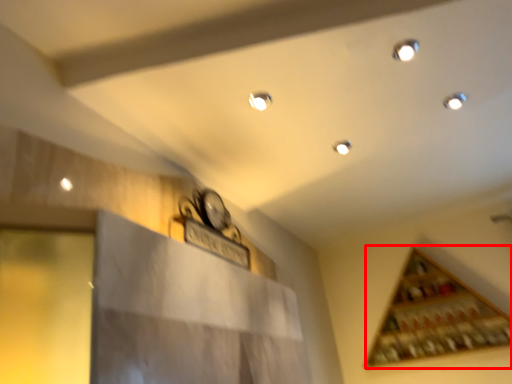
Question: From the image's perspective, considering the relative positions of wine rack (annotated by the red box) and light in the image provided, where is wine rack (annotated by the red box) located with respect to the staircase?

Choices:
 (A) below
 (B) above

Answer: (A)